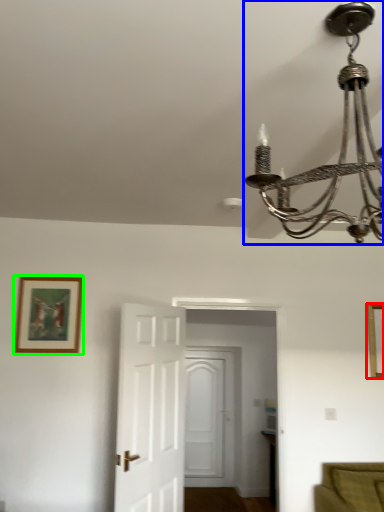
Question: Considering the real-world distances, which object is closest to picture frame (highlighted by a red box)? lamp (highlighted by a blue box) or picture frame (highlighted by a green box).

Choices:
 (A) lamp
 (B) picture frame

Answer: (B)